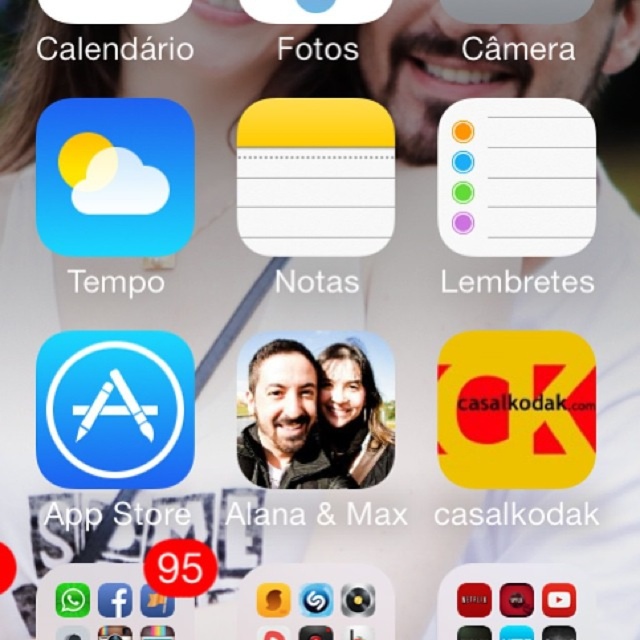
You are an art student analyzing two portraits displayed in an art gallery. The first is a matte black portrait at center, and the second is a smooth skin portrait at center. Which portrait occupies more space in the gallery?

The matte black portrait at center is bigger than the smooth skin portrait at center, so it occupies more space in the gallery.

You are standing 1.5 meters away from the smartphone screen. Can you reach the matte black portrait at center without moving closer?

The matte black portrait at center is 1.15 meters from the viewer. Since you are standing 1.5 meters away, you are too far to reach it without moving closer.

You are an art student analyzing two portraits displayed in a gallery. The first is a matte black portrait at center, and the second is a smooth skin portrait at center. From your vantage point, which portrait is positioned to the left?

The matte black portrait at center is positioned to the left of the smooth skin portrait at center.